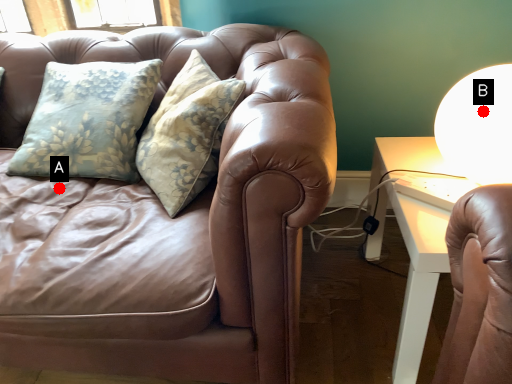
Question: Two points are circled on the image, labeled by A and B beside each circle. Among these points, which one is nearest to the camera?

Choices:
 (A) A is closer
 (B) B is closer

Answer: (B)